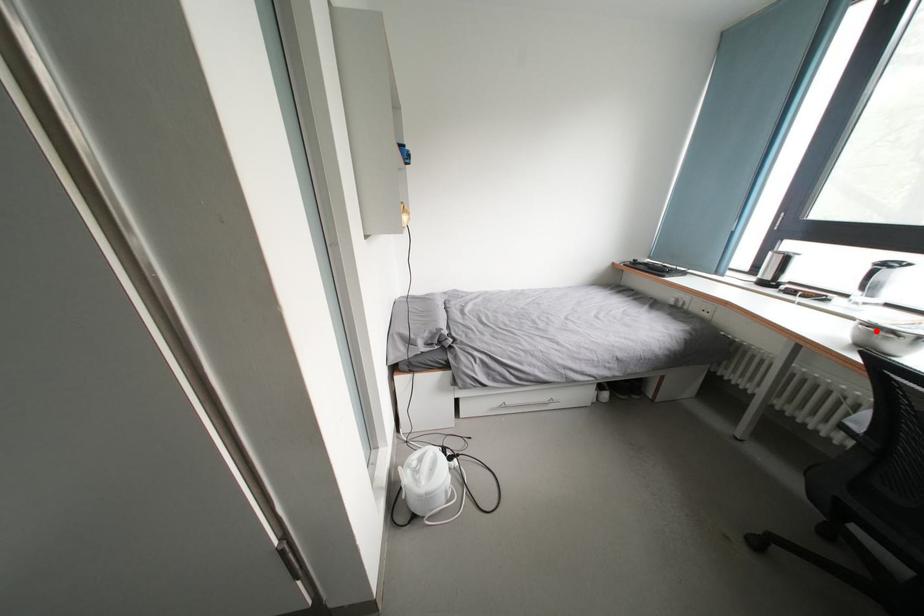
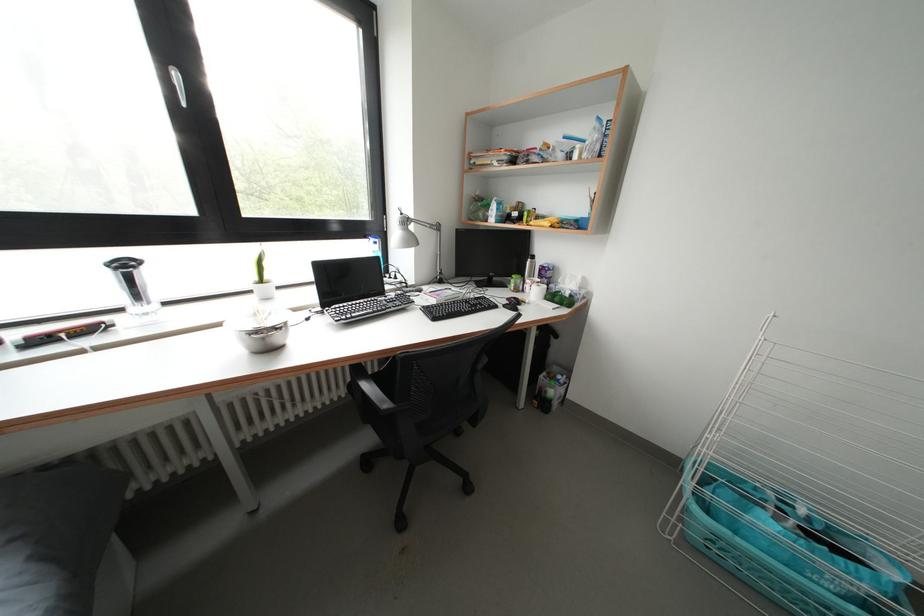
Question: I am providing you with two images of the same scene from different viewpoints. A red point is marked on the first image. Is the red point's position out of view in image 2?

Choices:
 (A) Yes
 (B) No

Answer: (B)